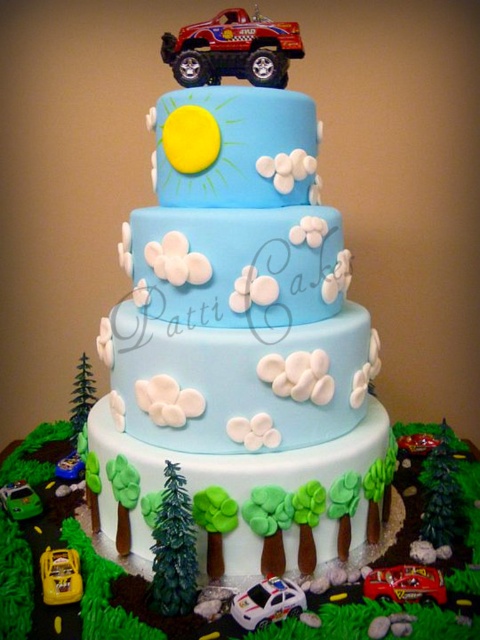
Who is higher up, yellow plastic toy car at lower left or metallic silver car at lower left?

metallic silver car at lower left is higher up.

Find the location of `yellow plastic toy car at lower left`. yellow plastic toy car at lower left is located at coordinates (60, 577).

Find the location of a particular element. yellow plastic toy car at lower left is located at coordinates (60, 577).

Between white glossy police car at lower center and metallic red car at center, which one has more height?

Standing taller between the two is white glossy police car at lower center.

Who is positioned more to the right, white glossy police car at lower center or metallic red car at center?

metallic red car at center

Between point (278, 620) and point (418, 579), which one is positioned in front?

Point (278, 620) is in front.

Find the location of a particular element. This screenshot has width=480, height=640. white glossy police car at lower center is located at coordinates (266, 602).

Between shiny red plastic truck at top and metallic silver car at lower left, which one is positioned lower?

metallic silver car at lower left

Locate an element on the screen. The width and height of the screenshot is (480, 640). shiny red plastic truck at top is located at coordinates (232, 49).